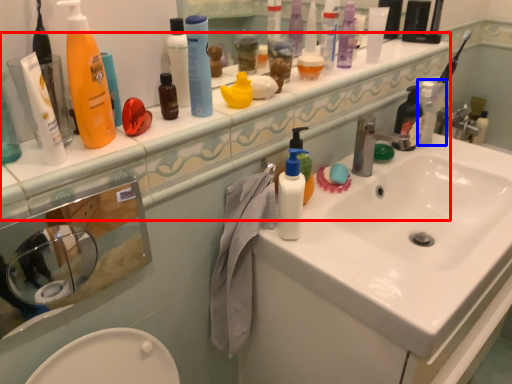
Question: Which object is closer to the camera taking this photo, counter top (highlighted by a red box) or cleaning product (highlighted by a blue box)?

Choices:
 (A) counter top
 (B) cleaning product

Answer: (A)